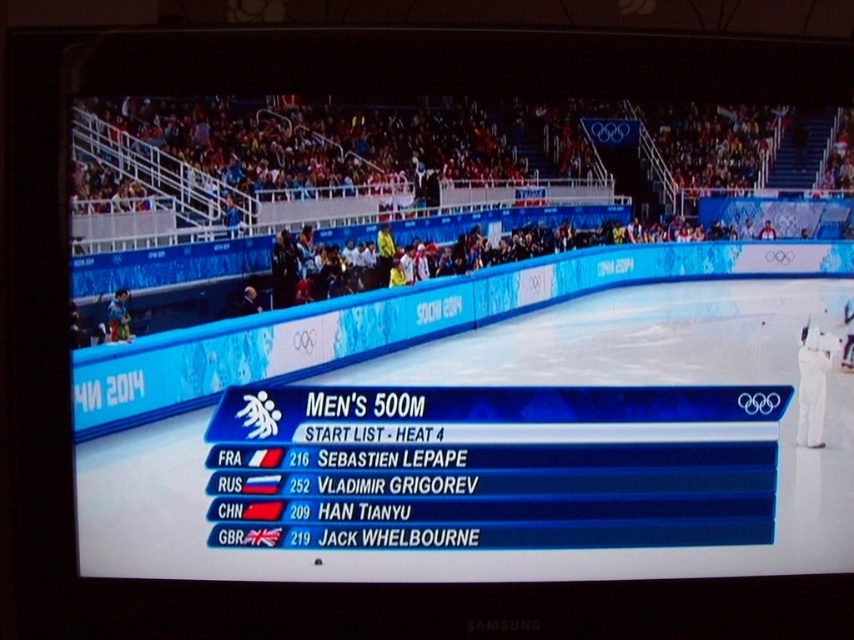
Does white glossy scoreboard at center have a smaller size compared to white cotton pants at right?

Incorrect, white glossy scoreboard at center is not smaller in size than white cotton pants at right.

Locate an element on the screen. This screenshot has height=640, width=854. white glossy scoreboard at center is located at coordinates (483, 428).

Find the location of a particular element. The image size is (854, 640). white glossy scoreboard at center is located at coordinates (483, 428).